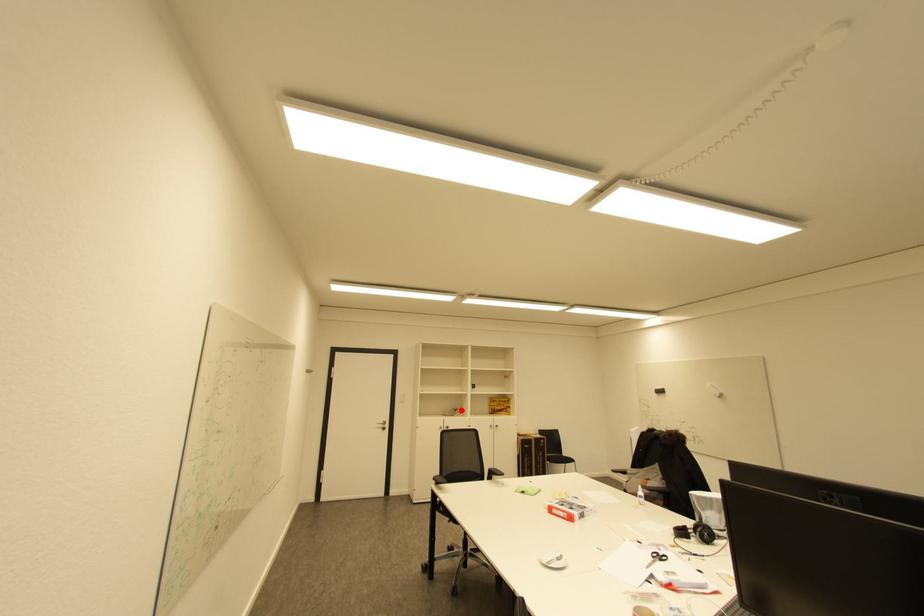
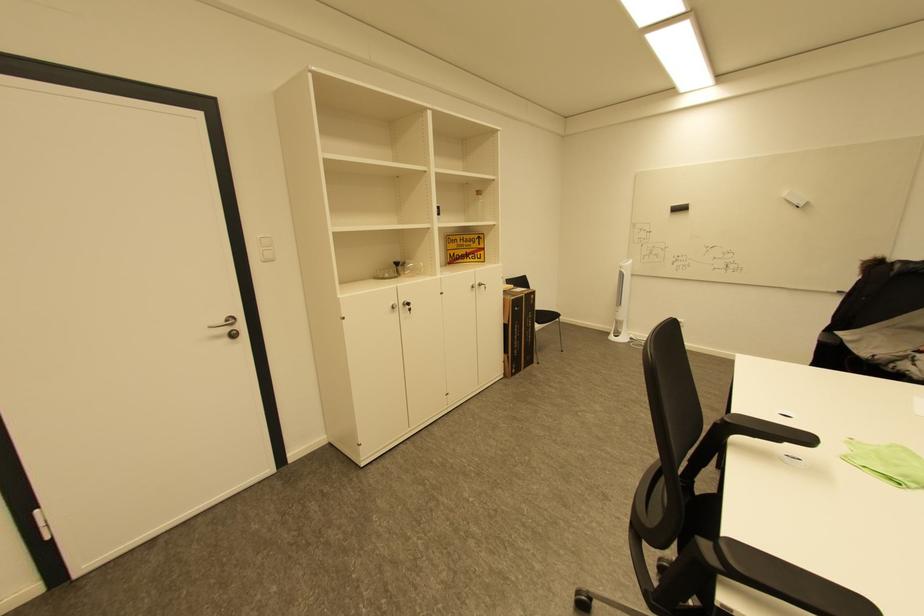
Question: A red point is marked in image1. In image2, is the corresponding 3D point closer to the camera or farther? Reply with the corresponding letter.

Choices:
 (A) The corresponding 3D point is closer.
 (B) The corresponding 3D point is farther.

Answer: (A)